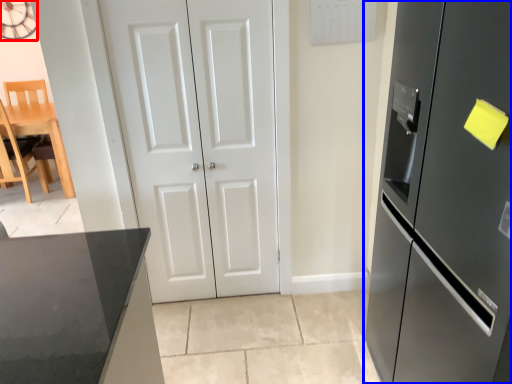
Question: Which object appears closest to the camera in this image, clock (highlighted by a red box) or refrigerator (highlighted by a blue box)?

Choices:
 (A) clock
 (B) refrigerator

Answer: (B)